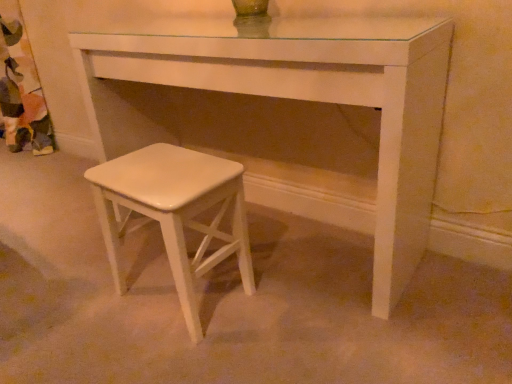
Question: Looking at their shapes, would you say white glossy stool at lower left is wider or thinner than white glossy stool at lower left?

Choices:
 (A) wide
 (B) thin

Answer: (A)

Question: Considering the positions of white glossy stool at lower left and white glossy stool at lower left in the image, is white glossy stool at lower left taller or shorter than white glossy stool at lower left?

Choices:
 (A) tall
 (B) short

Answer: (A)

Question: From the image's perspective, is white glossy stool at lower left positioned above or below white glossy stool at lower left?

Choices:
 (A) above
 (B) below

Answer: (A)

Question: Relative to white glossy stool at lower left, is white glossy stool at lower left in front or behind?

Choices:
 (A) front
 (B) behind

Answer: (B)

Question: In terms of height, does white glossy stool at lower left look taller or shorter compared to white glossy stool at lower left?

Choices:
 (A) short
 (B) tall

Answer: (A)

Question: Is white glossy stool at lower left inside or outside of white glossy stool at lower left?

Choices:
 (A) inside
 (B) outside

Answer: (B)

Question: Considering the positions of white glossy stool at lower left and white glossy stool at lower left in the image, is white glossy stool at lower left bigger or smaller than white glossy stool at lower left?

Choices:
 (A) big
 (B) small

Answer: (B)